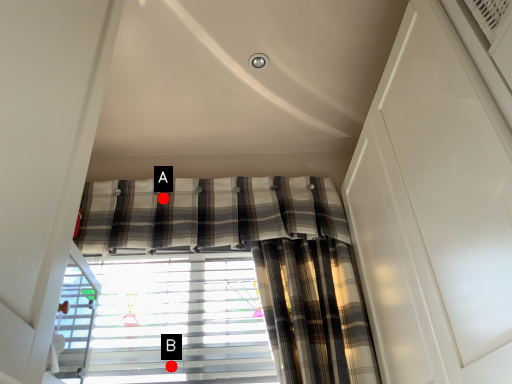
Question: Two points are circled on the image, labeled by A and B beside each circle. Among these points, which one is farthest from the camera?

Choices:
 (A) A is further
 (B) B is further

Answer: (A)